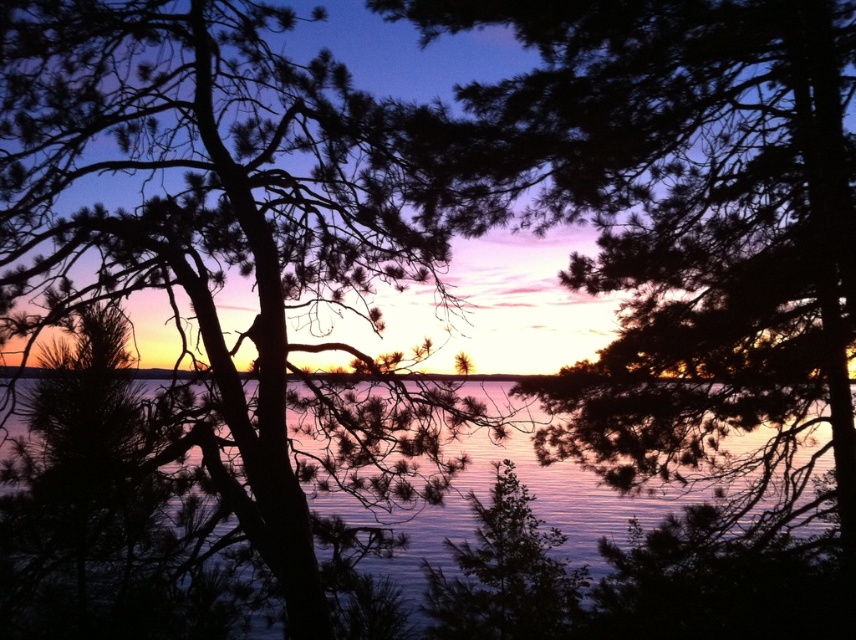
Is silhouette tree at center thinner than silky dark green branches at center?

Indeed, silhouette tree at center has a lesser width compared to silky dark green branches at center.

What do you see at coordinates (200, 310) in the screenshot?
I see `silhouette tree at center` at bounding box center [200, 310].

I want to click on silhouette tree at center, so click(x=200, y=310).

Is silky dark green branches at center to the right of blue reflective water at center from the viewer's perspective?

Indeed, silky dark green branches at center is positioned on the right side of blue reflective water at center.

The width and height of the screenshot is (856, 640). Describe the element at coordinates (687, 276) in the screenshot. I see `silky dark green branches at center` at that location.

What are the coordinates of `silky dark green branches at center` in the screenshot? It's located at (687, 276).

Is silhouette tree at center taller than blue reflective water at center?

No, silhouette tree at center is not taller than blue reflective water at center.

At what (x,y) coordinates should I click in order to perform the action: click on silhouette tree at center. Please return your answer as a coordinate pair (x, y). This screenshot has height=640, width=856. Looking at the image, I should click on (200, 310).